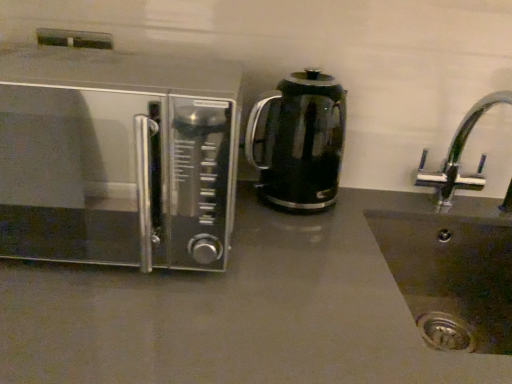
Identify the location of space that is in front of black glass kettle at center. (306, 250).